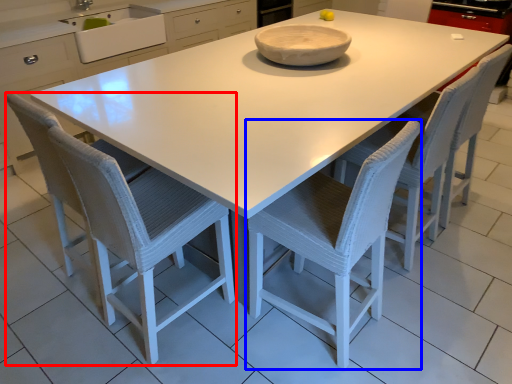
Question: Which object appears closest to the camera in this image, chair (highlighted by a red box) or chair (highlighted by a blue box)?

Choices:
 (A) chair
 (B) chair

Answer: (B)